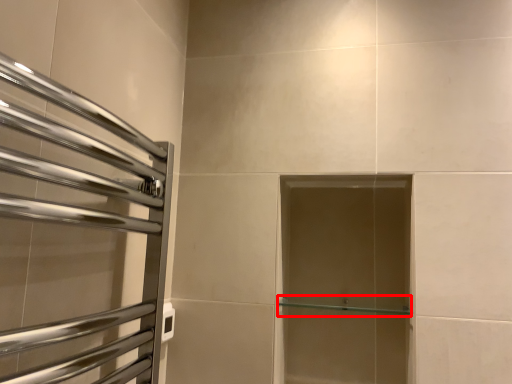
Question: From the image, what is the correct spatial relationship of shelf (annotated by the red box) in relation to screen door?

Choices:
 (A) right
 (B) left

Answer: (A)